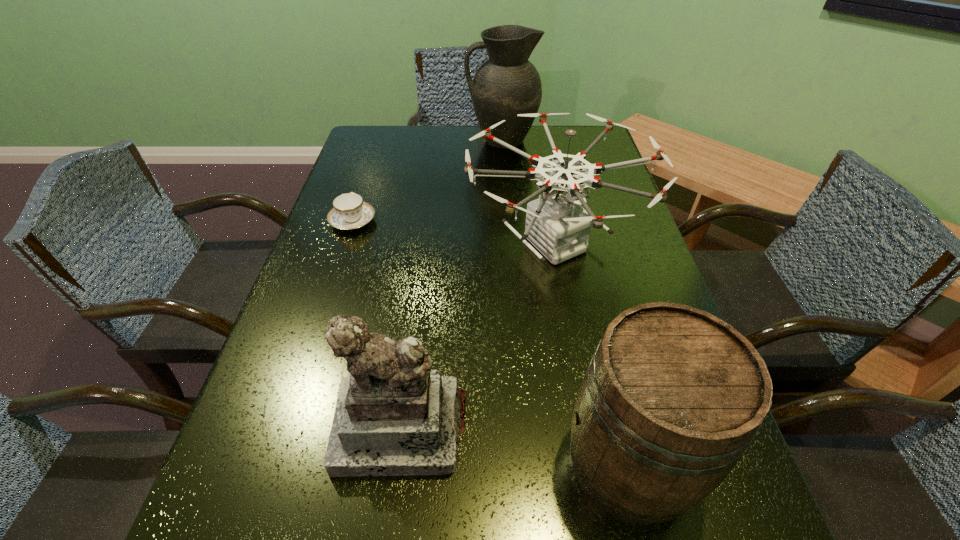
You are a GUI agent. You are given a task and a screenshot of the screen. Output one action in this format:
    pyautogui.click(x=<x>, y=<y>)
    Task: Click on the free location that satisfies the following two spatial constraints: 1. on the side of the drone with the handle; 2. on the right side of the pitcher
    The height and width of the screenshot is (540, 960).
    Given the screenshot: What is the action you would take?
    coord(509,244)

At what (x,y) coordinates should I click in order to perform the action: click on free space that satisfies the following two spatial constraints: 1. on the back side of the drone; 2. on the side of the pitcher with the handle. Please return your answer as a coordinate pair (x, y). Looking at the image, I should click on (536, 141).

You are a GUI agent. You are given a task and a screenshot of the screen. Output one action in this format:
    pyautogui.click(x=<x>, y=<y>)
    Task: Click on the vacant space that satisfies the following two spatial constraints: 1. on the back side of the drone; 2. on the side of the farthest object with the handle
    
    Given the screenshot: What is the action you would take?
    pyautogui.click(x=536, y=141)